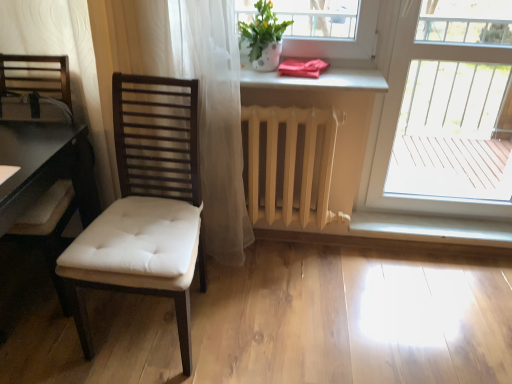
The width and height of the screenshot is (512, 384). Identify the location of vacant area on top of white glossy window sill at lower center (from a real-world perspective). (431, 224).